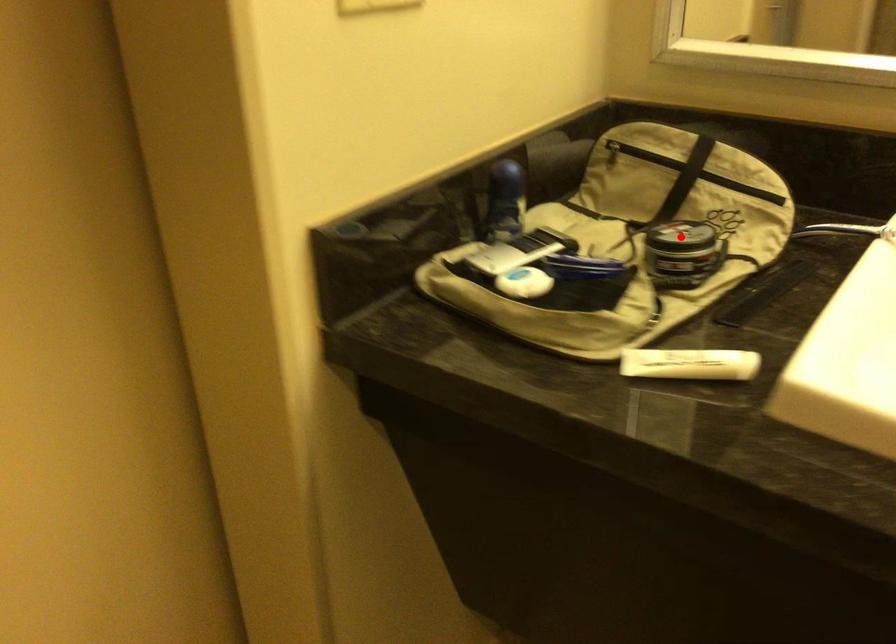
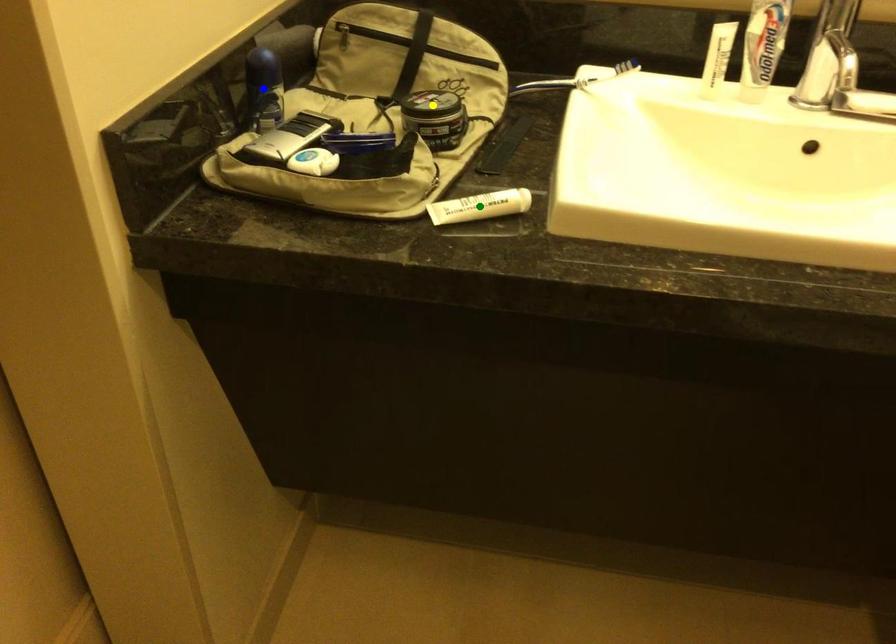
Question: I am providing you with two images of the same scene from different viewpoints. A red point is marked on the first image. You are given multiple points on the second image. Which spot in image 2 lines up with the point in image 1?

Choices:
 (A) blue point
 (B) yellow point
 (C) green point

Answer: (B)